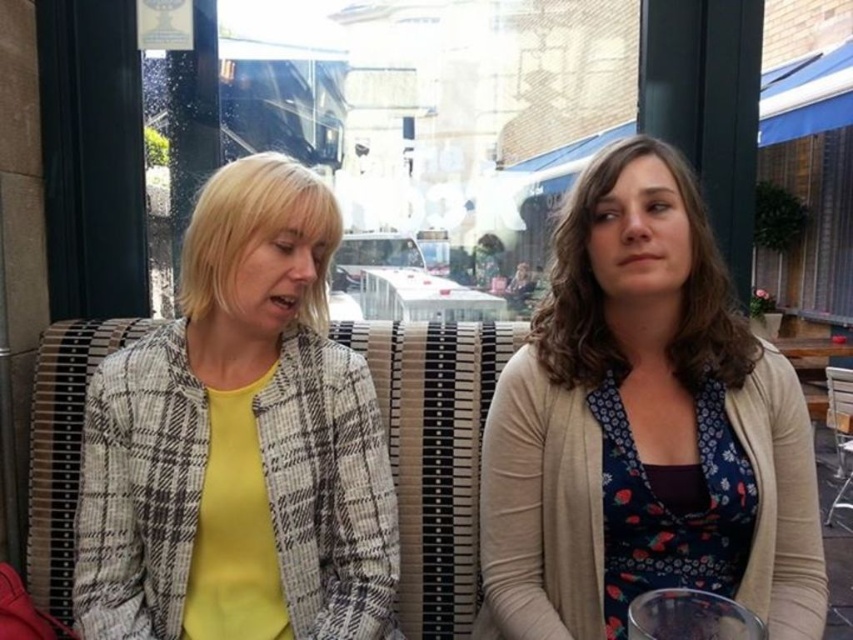
You are standing in front of the outdoor cafe scene. There are two points marked in the image. The first point is at coordinate point (326,627) and the second is at point (495,305). If you want to touch the point that is closer to you, which coordinate should you aim for?

Point (326,627) is closer to the viewer than point (495,305), so you should aim for point (326,627).

Based on the scene, which object at the center is bigger, the floral print blouse at center or the white plastic table at center?

The floral print blouse at center is larger in size than the white plastic table at center.